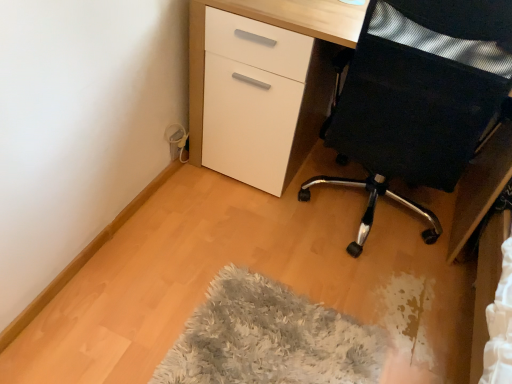
Question: From the image's perspective, would you say white glossy desk at center is positioned over black mesh chair at right?

Choices:
 (A) yes
 (B) no

Answer: (A)

Question: Is white glossy desk at center facing away from black mesh chair at right?

Choices:
 (A) no
 (B) yes

Answer: (B)

Question: Can you confirm if white glossy desk at center is taller than black mesh chair at right?

Choices:
 (A) yes
 (B) no

Answer: (B)

Question: From a real-world perspective, does white glossy desk at center stand above black mesh chair at right?

Choices:
 (A) yes
 (B) no

Answer: (B)

Question: Considering the relative positions of white glossy desk at center and black mesh chair at right in the image provided, is white glossy desk at center to the right of black mesh chair at right from the viewer's perspective?

Choices:
 (A) no
 (B) yes

Answer: (A)

Question: From the image's perspective, is white glossy desk at center beneath black mesh chair at right?

Choices:
 (A) yes
 (B) no

Answer: (B)

Question: From a real-world perspective, is fluffy gray mat at lower center on black mesh chair at right?

Choices:
 (A) no
 (B) yes

Answer: (A)

Question: Can you confirm if fluffy gray mat at lower center is shorter than black mesh chair at right?

Choices:
 (A) yes
 (B) no

Answer: (A)

Question: Does fluffy gray mat at lower center appear on the right side of black mesh chair at right?

Choices:
 (A) yes
 (B) no

Answer: (B)

Question: Considering the relative sizes of fluffy gray mat at lower center and black mesh chair at right in the image provided, is fluffy gray mat at lower center wider than black mesh chair at right?

Choices:
 (A) yes
 (B) no

Answer: (A)

Question: Can you confirm if fluffy gray mat at lower center is smaller than black mesh chair at right?

Choices:
 (A) no
 (B) yes

Answer: (B)

Question: From a real-world perspective, is fluffy gray mat at lower center positioned under black mesh chair at right based on gravity?

Choices:
 (A) no
 (B) yes

Answer: (B)

Question: Can you confirm if fluffy gray mat at lower center is bigger than white glossy desk at center?

Choices:
 (A) no
 (B) yes

Answer: (A)